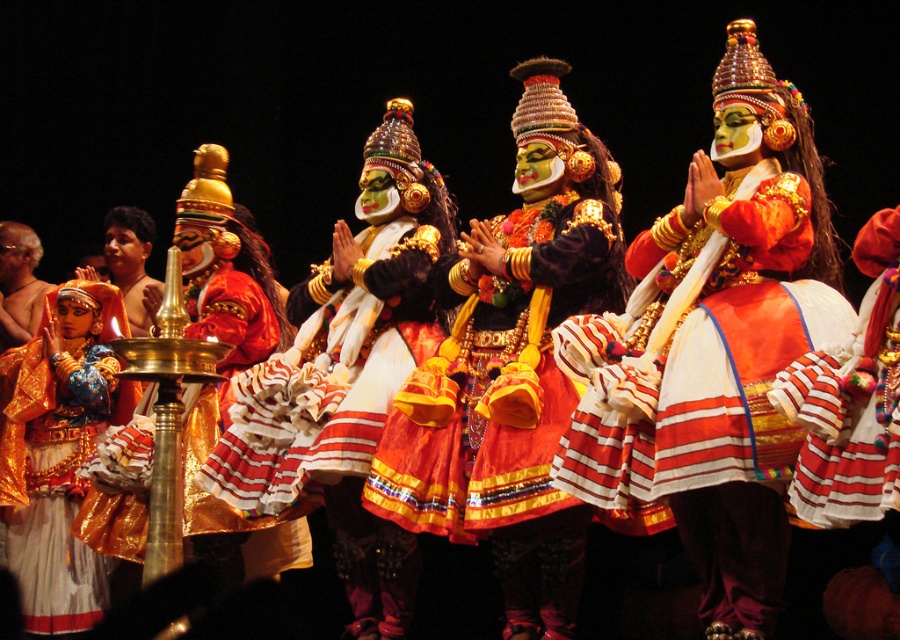
Is shiny gold headdress at center to the left of matte gold ornament at left from the viewer's perspective?

Incorrect, shiny gold headdress at center is not on the left side of matte gold ornament at left.

Is shiny gold headdress at center in front of matte gold ornament at left?

Yes, shiny gold headdress at center is in front of matte gold ornament at left.

This screenshot has width=900, height=640. Find the location of `shiny gold headdress at center`. shiny gold headdress at center is located at coordinates pos(513,368).

Can you confirm if matte orange fabric at center is wider than matte gold ornament at left?

Correct, the width of matte orange fabric at center exceeds that of matte gold ornament at left.

The image size is (900, 640). I want to click on matte orange fabric at center, so click(704, 385).

What do you see at coordinates (704, 385) in the screenshot? I see `matte orange fabric at center` at bounding box center [704, 385].

Who is more distant from viewer, [770,472] or [554,244]?

The point [554,244] is more distant.

What are the coordinates of `matte orange fabric at center` in the screenshot? It's located at (704, 385).